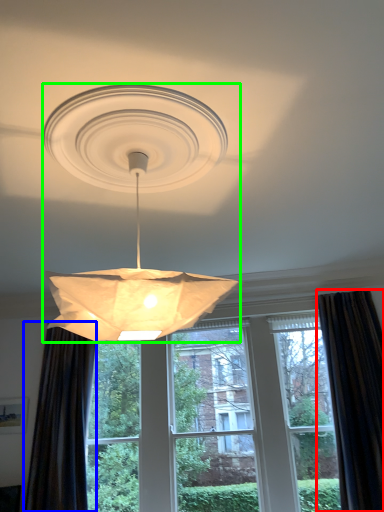
Question: Which is nearer to the curtain (highlighted by a red box)? curtain (highlighted by a blue box) or lamp (highlighted by a green box).

Choices:
 (A) curtain
 (B) lamp

Answer: (A)